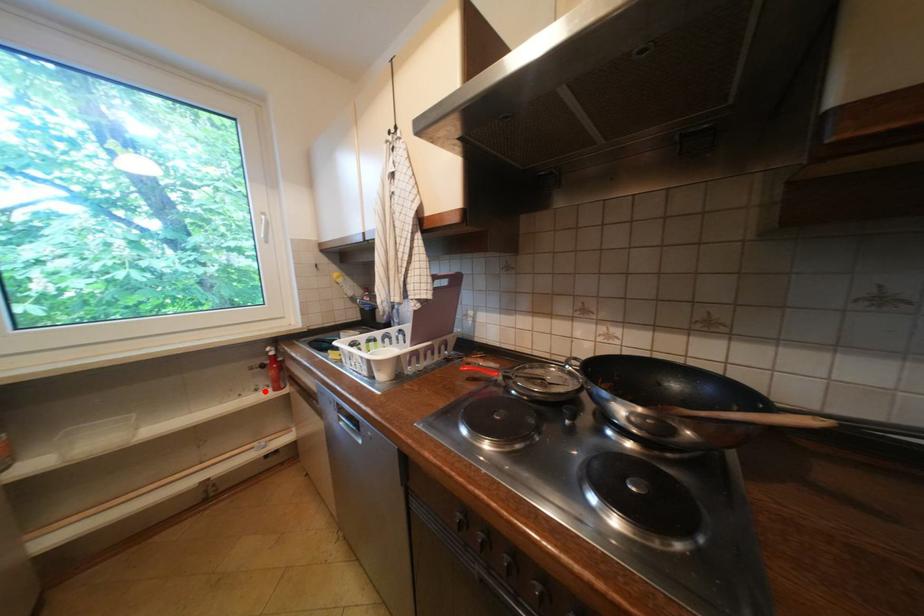
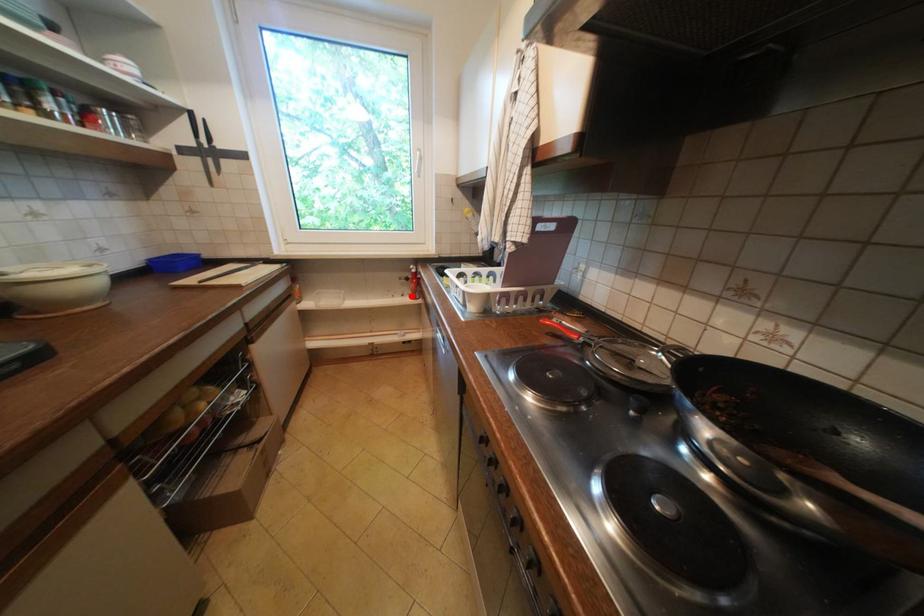
I am providing you with two images of the same scene from different viewpoints. A red point is marked on the first image and another point is marked on the second image. Is the marked point in image1 the same physical position as the marked point in image2?

Yes